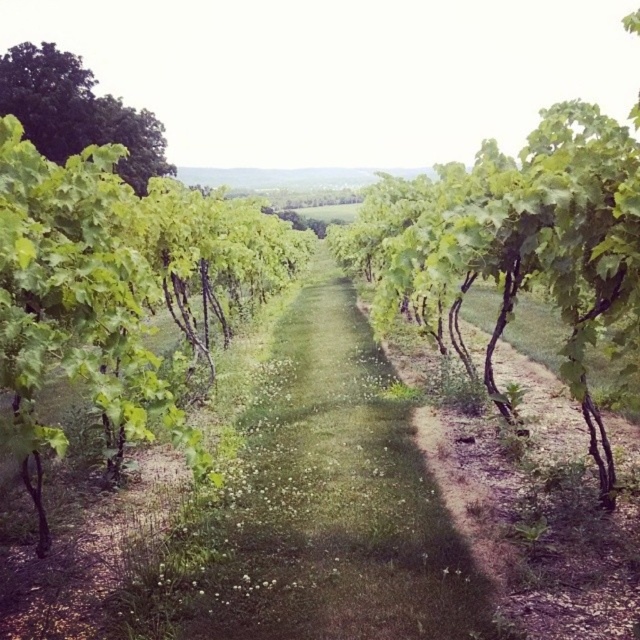
Is point (378, 189) closer to camera compared to point (164, 172)?

Yes.

Is green leafy vine at center thinner than green leafy tree at upper left?

In fact, green leafy vine at center might be wider than green leafy tree at upper left.

This screenshot has height=640, width=640. Describe the element at coordinates (515, 243) in the screenshot. I see `green leafy vine at center` at that location.

Image resolution: width=640 pixels, height=640 pixels. Identify the location of green leafy vine at center. (515, 243).

Is point (81, 298) positioned after point (493, 276)?

No, it is in front of (493, 276).

Can you confirm if green leafy tree at center is wider than green leafy vine at center?

No.

Identify the location of green leafy tree at center. Image resolution: width=640 pixels, height=640 pixels. (115, 291).

Can you confirm if green leafy tree at center is smaller than green leafy tree at upper left?

No.

Is point (115, 276) positioned in front of point (38, 76)?

Yes, it is in front of point (38, 76).

This screenshot has width=640, height=640. What do you see at coordinates (115, 291) in the screenshot?
I see `green leafy tree at center` at bounding box center [115, 291].

Where is `green leafy tree at center`? The width and height of the screenshot is (640, 640). green leafy tree at center is located at coordinates (115, 291).